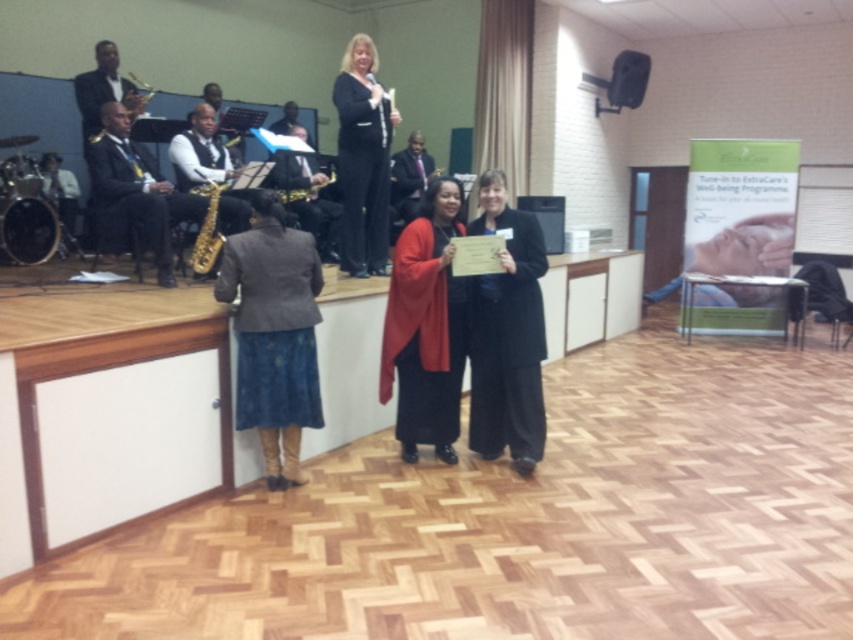
Question: Is matte red coat at center to the left of shiny black suit at left from the viewer's perspective?

Choices:
 (A) no
 (B) yes

Answer: (A)

Question: Is matte red coat at center closer to camera compared to shiny black suit at left?

Choices:
 (A) yes
 (B) no

Answer: (A)

Question: Among these points, which one is farthest from the camera?

Choices:
 (A) (349, 182)
 (B) (511, 272)
 (C) (155, 262)
 (D) (308, 419)

Answer: (C)

Question: Estimate the real-world distances between objects in this image. Which object is closer to the shiny black suit at left?

Choices:
 (A) dark gray textured blazer at lower left
 (B) black glossy suit at upper center
 (C) matte red coat at center
 (D) black matte coat at center

Answer: (B)

Question: Among these objects, which one is farthest from the camera?

Choices:
 (A) black matte coat at center
 (B) shiny black suit at left

Answer: (B)

Question: Is black matte coat at center positioned behind shiny black suit at left?

Choices:
 (A) yes
 (B) no

Answer: (B)